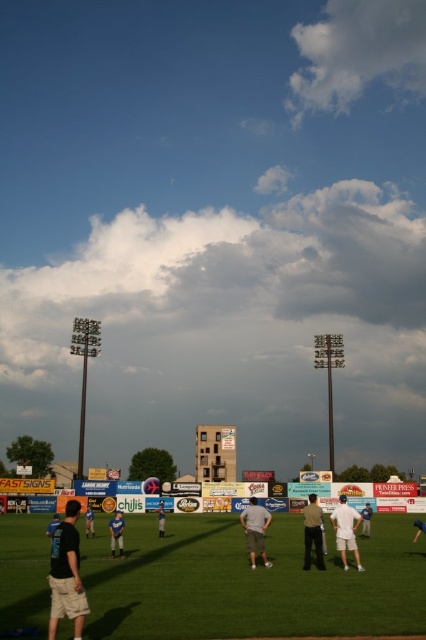
Can you confirm if khaki cotton shirt at center is positioned to the right of white cotton shirt at center?

In fact, khaki cotton shirt at center is to the left of white cotton shirt at center.

Between khaki cotton shirt at center and white cotton shirt at center, which one appears on the left side from the viewer's perspective?

khaki cotton shirt at center

This screenshot has height=640, width=426. Find the location of `khaki cotton shirt at center`. khaki cotton shirt at center is located at coordinates (313, 532).

This screenshot has height=640, width=426. In order to click on khaki cotton shirt at center in this screenshot , I will do `click(313, 532)`.

Is white cotton shorts at center above dark blue shirt at lower left?

Yes, white cotton shorts at center is above dark blue shirt at lower left.

Is white cotton shorts at center wider than dark blue shirt at lower left?

Yes.

Find the location of a particular element. Image resolution: width=426 pixels, height=640 pixels. white cotton shorts at center is located at coordinates (345, 531).

The height and width of the screenshot is (640, 426). What do you see at coordinates (365, 520) in the screenshot? I see `white cotton shirt at center` at bounding box center [365, 520].

Does point (370, 516) lie behind point (416, 538)?

Yes, point (370, 516) is farther from viewer.

This screenshot has width=426, height=640. Find the location of `white cotton shirt at center`. white cotton shirt at center is located at coordinates (365, 520).